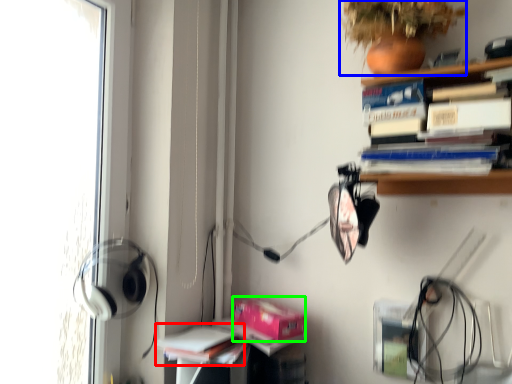
Question: Which is nearer to the book (highlighted by a red box)? plant (highlighted by a blue box) or paperback book (highlighted by a green box).

Choices:
 (A) plant
 (B) paperback book

Answer: (B)